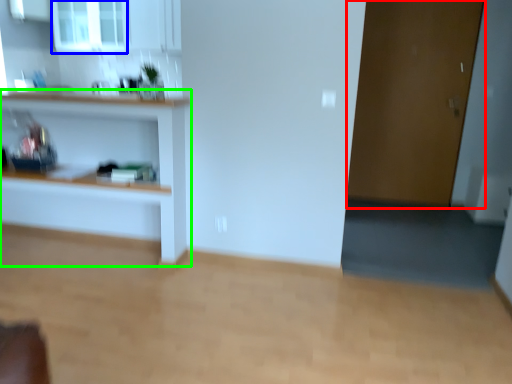
Question: Which object is positioned farthest from door (highlighted by a red box)? Select from window (highlighted by a blue box) and shelf (highlighted by a green box).

Choices:
 (A) window
 (B) shelf

Answer: (A)